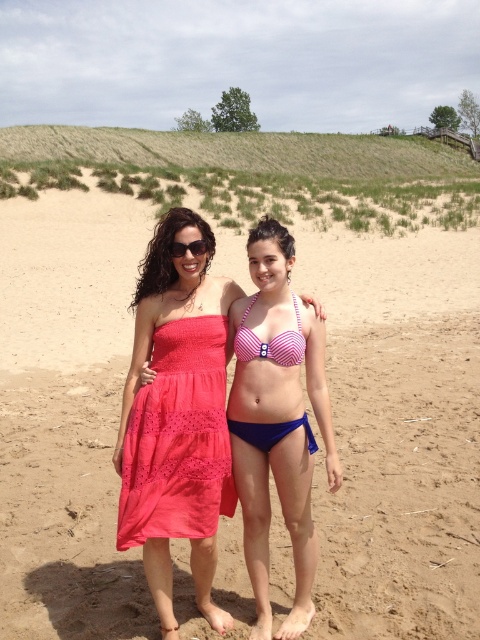
Question: Which point is farther to the camera?

Choices:
 (A) beige sandy beach at center
 (B) pink striped bikini at center

Answer: (A)

Question: Observing the image, what is the correct spatial positioning of pink striped bikini at center in reference to black plastic sunglasses at upper center?

Choices:
 (A) below
 (B) above

Answer: (A)

Question: Which point is closer to the camera taking this photo?

Choices:
 (A) (164, 492)
 (B) (84, 362)
 (C) (203, 556)
 (D) (202, 240)

Answer: (A)

Question: Does pink striped bikini at center have a larger size compared to matte coral dress at center?

Choices:
 (A) yes
 (B) no

Answer: (A)

Question: Is pink striped bikini at center behind black plastic sunglasses at upper center?

Choices:
 (A) no
 (B) yes

Answer: (A)

Question: Which point is farther to the camera?

Choices:
 (A) tap(173, 256)
 (B) tap(360, 580)
 (C) tap(193, 438)
 (D) tap(212, 390)

Answer: (B)